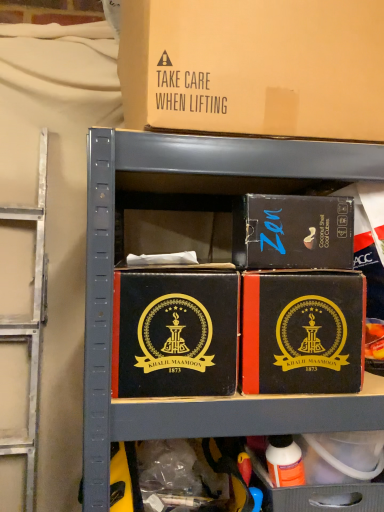
Question: Is point (263, 32) positioned closer to the camera than point (284, 244)?

Choices:
 (A) closer
 (B) farther

Answer: (A)

Question: From a real-world perspective, relative to matte black box at upper right, marked as the third box in a bottom-to-top arrangement, is brown cardboard box at upper center, which appears as the first box when viewed from the top, vertically above or below?

Choices:
 (A) below
 (B) above

Answer: (B)

Question: Based on their relative distances, which object is nearer to the matte black box at center, placed as the fourth box when sorted from top to bottom?

Choices:
 (A) brown cardboard box at upper center, which appears as the first box when viewed from the top
 (B) black leather box at center, which is the 2th box from bottom to top
 (C) matte black box at upper right, arranged as the second box when viewed from the top

Answer: (C)

Question: Estimate the real-world distances between objects in this image. Which object is closer to the matte black box at center, acting as the 1th box starting from the bottom?

Choices:
 (A) matte black box at upper right, marked as the third box in a bottom-to-top arrangement
 (B) black leather box at center, which is the 2th box from bottom to top
 (C) brown cardboard box at upper center, which appears as the first box when viewed from the top

Answer: (A)